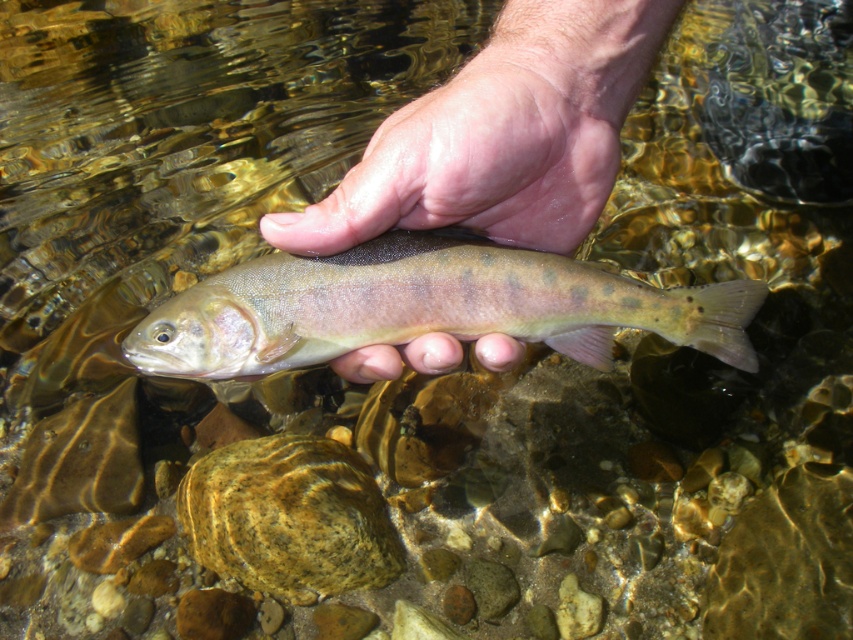
Can you confirm if smooth skin hand at center is positioned to the left of shiny silver fish at center?

No, smooth skin hand at center is not to the left of shiny silver fish at center.

Measure the distance between smooth skin hand at center and camera.

smooth skin hand at center and camera are 41.42 centimeters apart from each other.

Locate an element on the screen. The height and width of the screenshot is (640, 853). smooth skin hand at center is located at coordinates (502, 134).